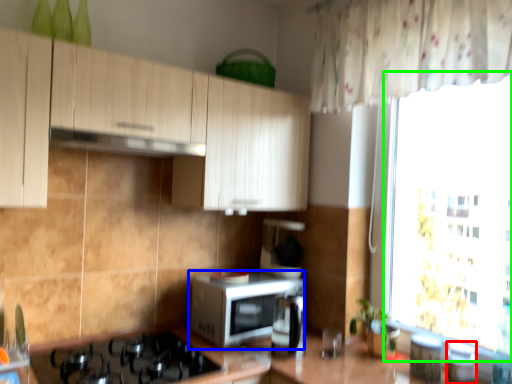
Question: Which object is the closest to the appliance (highlighted by a red box)? Choose among these: microwave oven (highlighted by a blue box) or window screen (highlighted by a green box).

Choices:
 (A) microwave oven
 (B) window screen

Answer: (A)